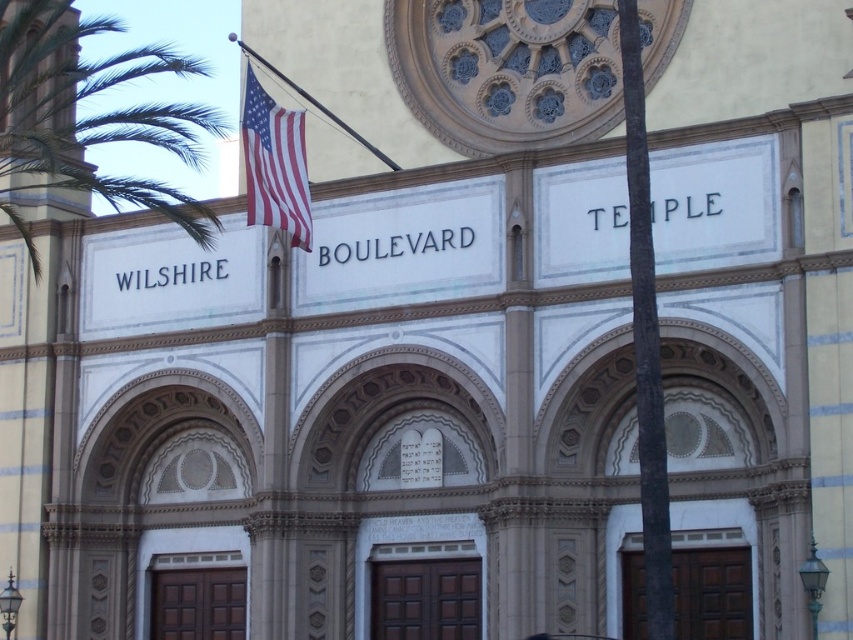
You are standing in front of the Wilshire Boulevard Temple and want to take a photo of the temple without any obstructions. The green leafy palm tree at left and the american flag at upper left are in your view. Which object should you move to avoid blocking the temple?

You should move the green leafy palm tree at left because it is in front of the american flag at upper left, so removing it would allow a clearer view of the temple.

You are standing at the entrance of Wilshire Boulevard Temple and want to take a photo that includes both the green leafy palm tree at left and the american flag at upper left. What is the minimum distance you should move away from the temple to ensure both objects are in frame?

To include both the green leafy palm tree at left and the american flag at upper left in your photo, you need to move at least 7.54 meters away from the temple, as that is the distance between them.

You are standing in front of the Wilshire Boulevard Temple and notice the green leafy palm tree at left and the american flag at upper left. Which object is positioned higher up on the building?

The green leafy palm tree at left is located above the american flag at upper left, so it is positioned higher up on the building.